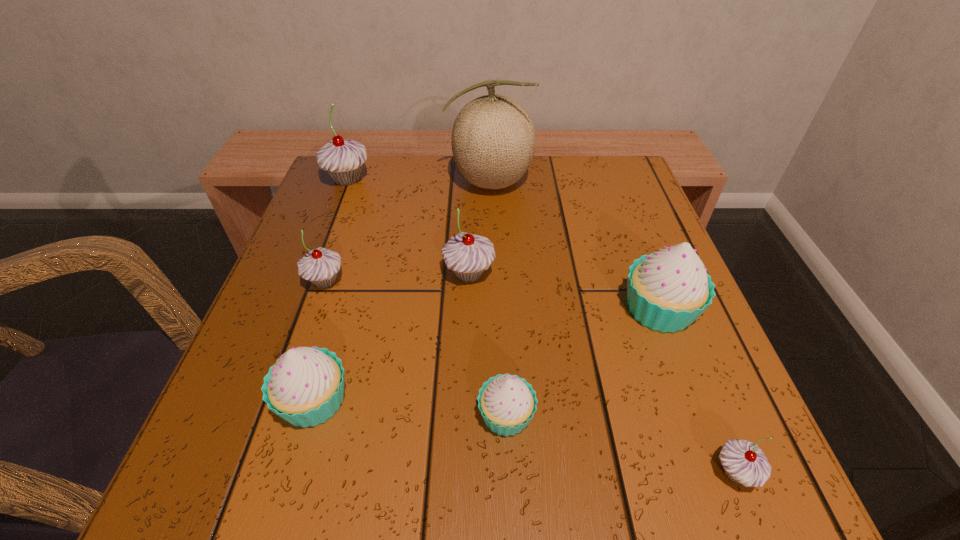
Where is `free space between the biggest white cupcake and the second biggest white cupcake`? The width and height of the screenshot is (960, 540). free space between the biggest white cupcake and the second biggest white cupcake is located at coordinates (487, 355).

At what (x,y) coordinates should I click in order to perform the action: click on empty space that is in between the nearest gray cupcake and the cantaloup. Please return your answer as a coordinate pair (x, y). Looking at the image, I should click on (612, 327).

Where is `vacant space in between the biggest white cupcake and the second biggest gray cupcake`? The height and width of the screenshot is (540, 960). vacant space in between the biggest white cupcake and the second biggest gray cupcake is located at coordinates (564, 292).

I want to click on vacant region between the second smallest gray cupcake and the second smallest white cupcake, so click(320, 341).

Where is `vacant region between the rightmost white cupcake and the third biggest gray cupcake`? The height and width of the screenshot is (540, 960). vacant region between the rightmost white cupcake and the third biggest gray cupcake is located at coordinates (492, 295).

The height and width of the screenshot is (540, 960). I want to click on vacant space that is in between the biggest white cupcake and the third biggest gray cupcake, so click(x=492, y=295).

The height and width of the screenshot is (540, 960). What are the coordinates of `unoccupied position between the third smallest gray cupcake and the cantaloup` in the screenshot? It's located at (479, 228).

Find the location of a particular element. free point between the farthest gray cupcake and the second biggest gray cupcake is located at coordinates (408, 227).

At what (x,y) coordinates should I click in order to perform the action: click on empty space that is in between the second tallest object and the smallest white cupcake. Please return your answer as a coordinate pair (x, y). Looking at the image, I should click on (427, 298).

The width and height of the screenshot is (960, 540). Identify the location of free spot between the nearest cupcake and the third gray cupcake from left to right. (602, 373).